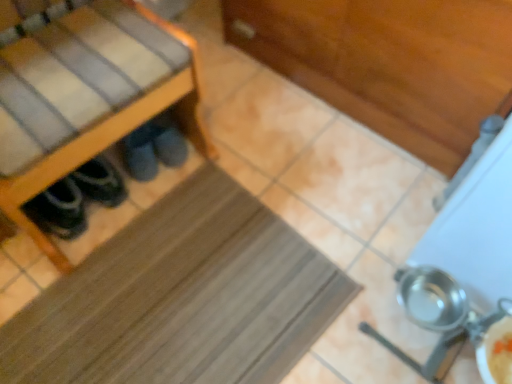
Locate an element on the screen. The height and width of the screenshot is (384, 512). free spot to the right of wooden shoe rack at left is located at coordinates (254, 182).